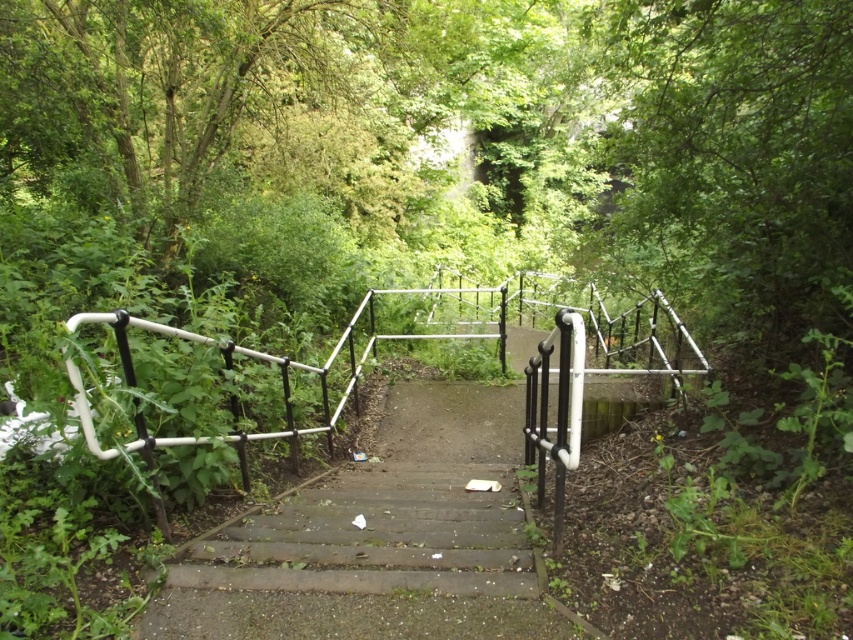
Looking at this image, can you confirm if green leafy tree at upper left is smaller than wooden stairs at center?

Yes.

Can you confirm if green leafy tree at upper left is positioned to the left of wooden stairs at center?

Yes, green leafy tree at upper left is to the left of wooden stairs at center.

Does point (236, 65) come closer to viewer compared to point (271, 524)?

No, (236, 65) is further to viewer.

Where is `green leafy tree at upper left`? The width and height of the screenshot is (853, 640). green leafy tree at upper left is located at coordinates pyautogui.click(x=195, y=108).